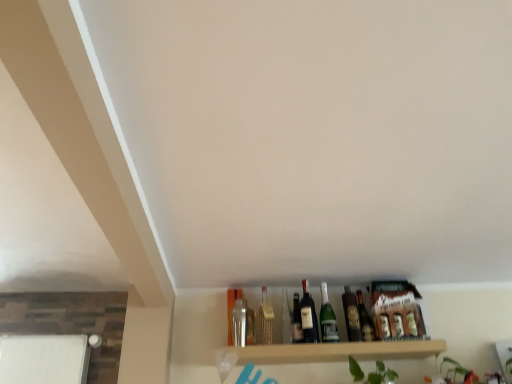
At what (x,y) coordinates should I click in order to perform the action: click on vacant area on top of wooden shelf at lower center (from a real-world perspective). Please return your answer as a coordinate pair (x, y). Image resolution: width=512 pixels, height=384 pixels. Looking at the image, I should click on (321, 347).